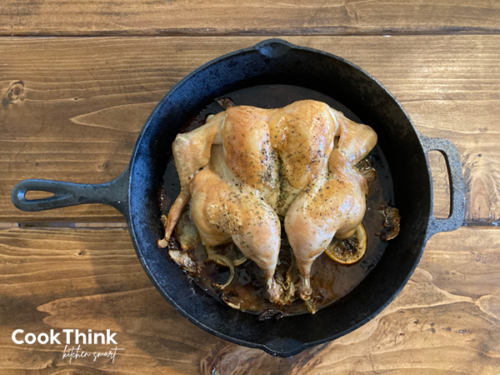
Where is `handle`? This screenshot has height=375, width=500. handle is located at coordinates (85, 194).